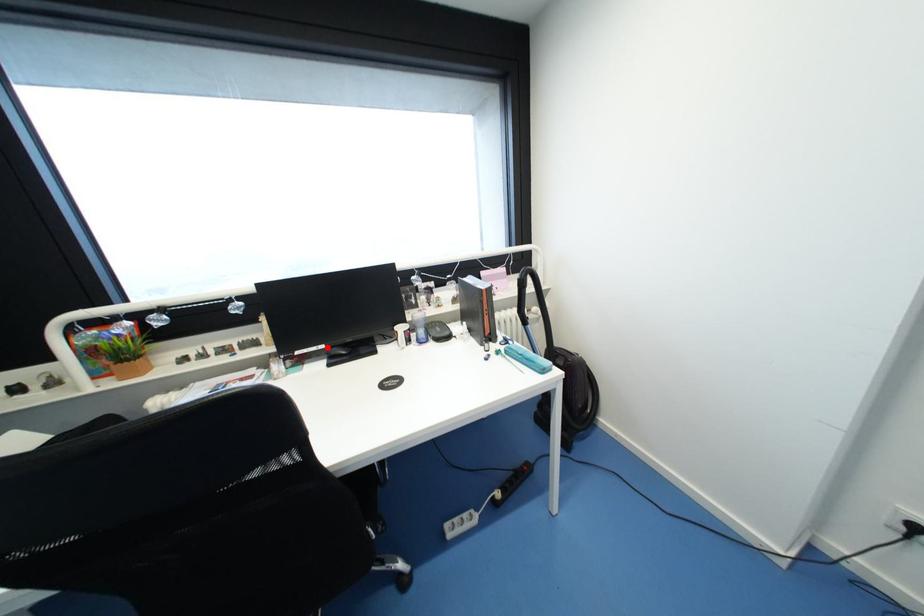
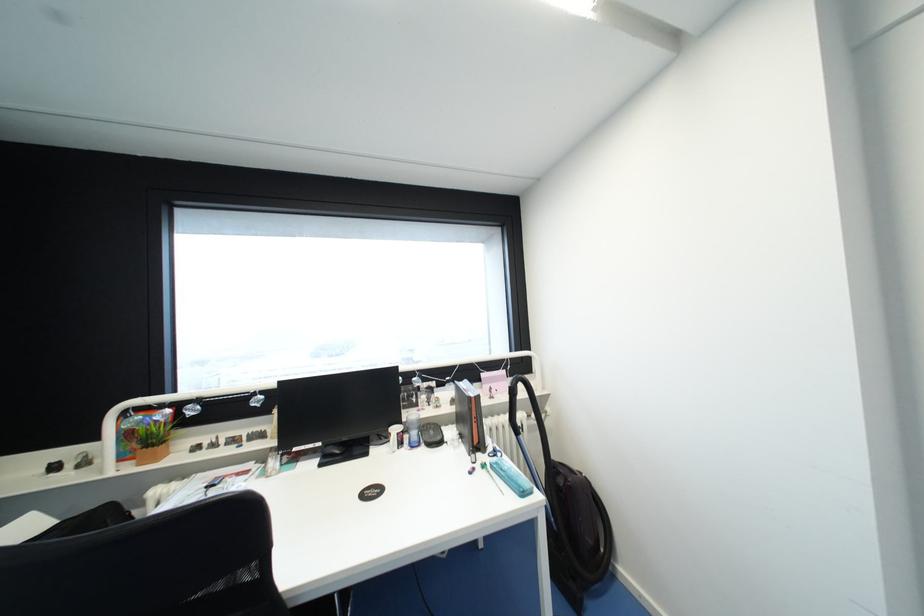
Question: I am providing you with two images of the same scene from different viewpoints. In image1, a red point is highlighted. Considering the same 3D point in image2, which of the following is correct?

Choices:
 (A) It is closer
 (B) It is farther

Answer: (B)